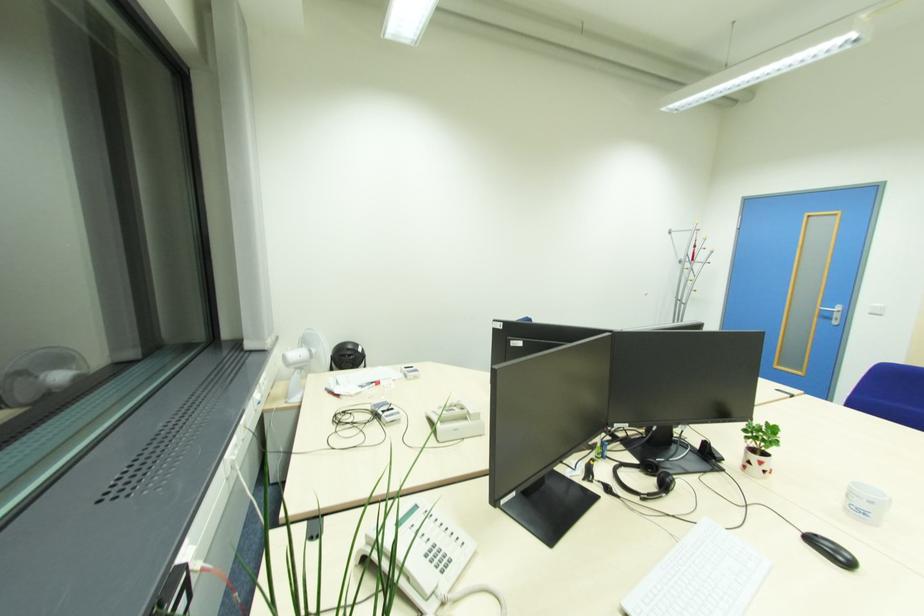
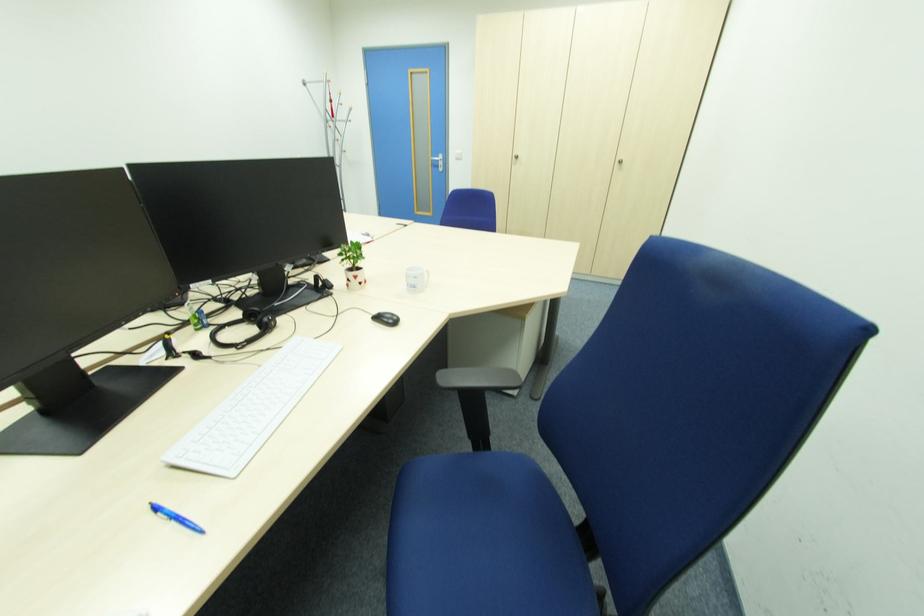
The images are taken continuously from a first-person perspective. In which direction is your viewpoint rotating?

The camera's rotation is toward right-down.